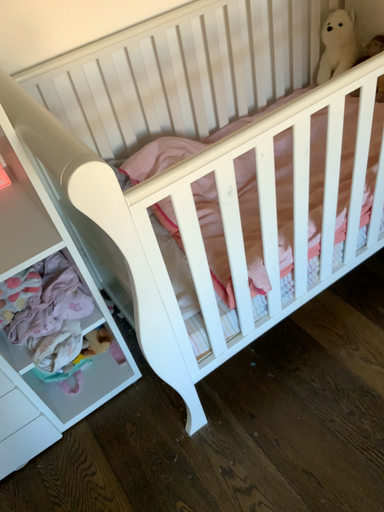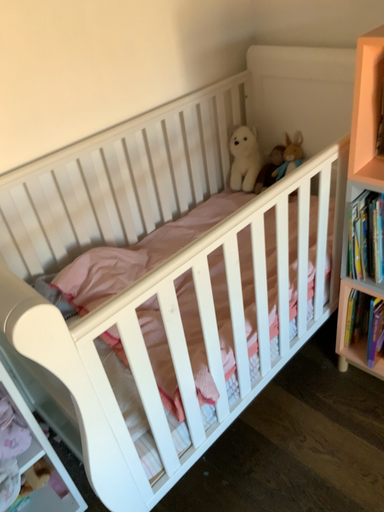
Question: Which way did the camera rotate in the video?

Choices:
 (A) rotated left
 (B) rotated right

Answer: (B)